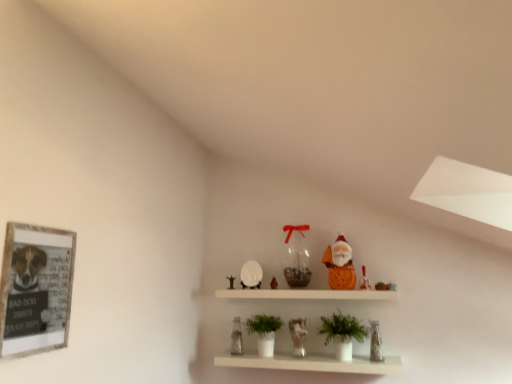
This screenshot has height=384, width=512. In order to click on vacant space that is to the left of matte orange santa at upper center, positioned as the sixth toy in left-to-right order in this screenshot , I will do `click(343, 287)`.